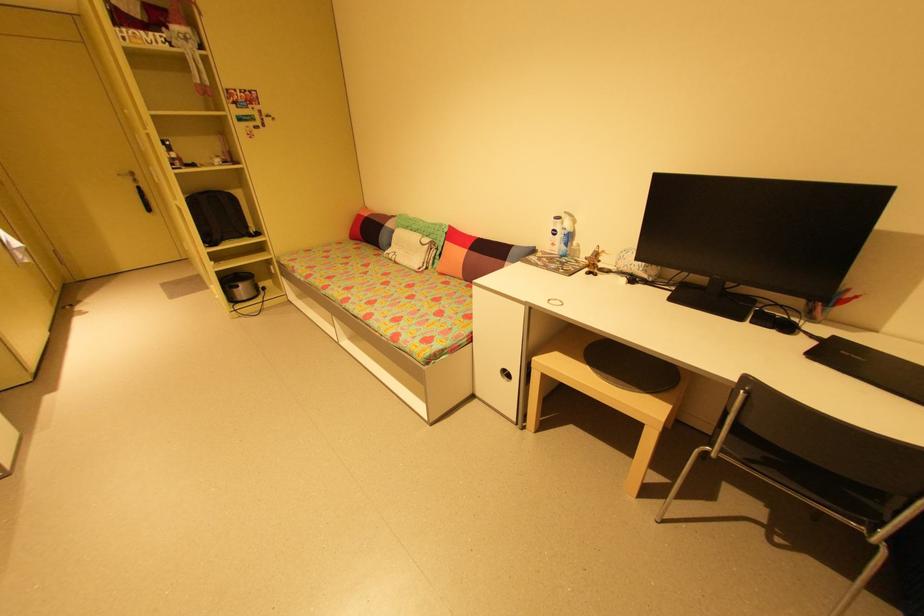
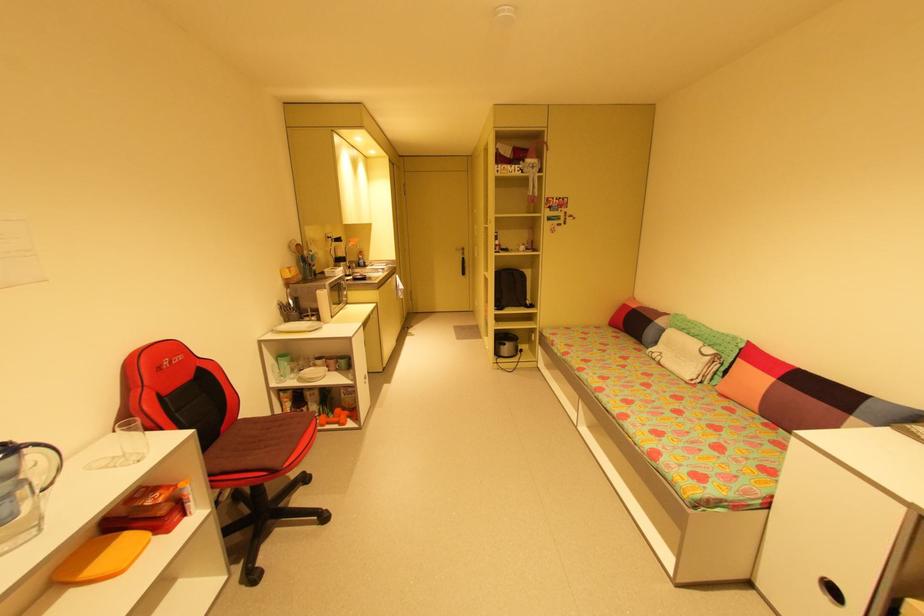
In the second image, find the point that corresponds to the point at 242,193 in the first image.

(532, 273)